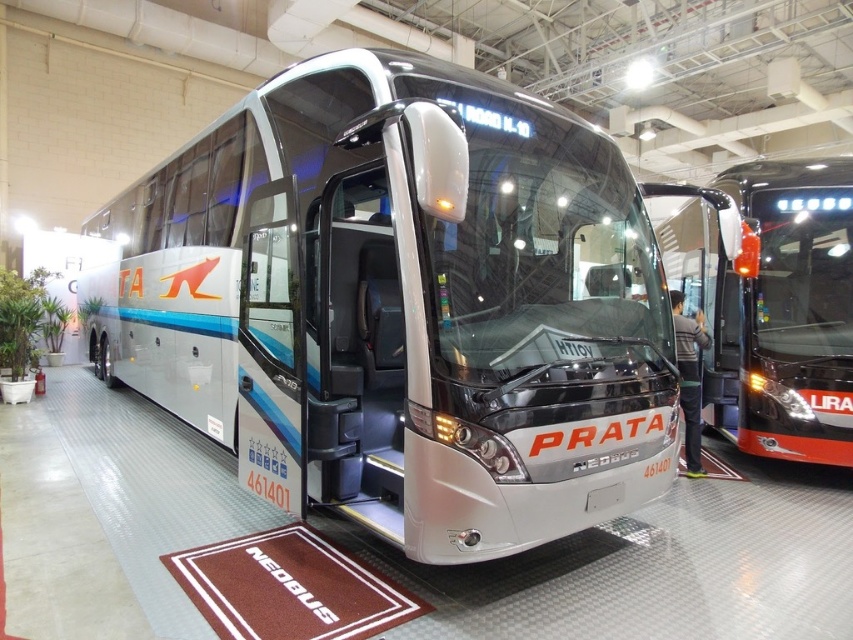
You are planning to place a new exhibit in the trade show. The exhibit requires a space that is 2 meters away from the sleek silver bus at center. Where should you place the exhibit to meet this requirement?

The exhibit should be placed at least 2 meters away from the sleek silver bus at center, which is located at point (402, 305). The exact placement would depend on the layout of the exhibition hall, but ensuring the distance requirement is met is crucial.

You are standing at point A located at coordinates point A at (422, 200). You need to walk to point B, which is 3.12 meters away from you. Is there enough space to walk directly to point B without any obstacles?

The distance between point A at (422, 200) and point B is 3.12 meters. Since the scene shows an indoor exhibition space with a high ceiling and exposed ductwork but no mention of obstacles between the points, there is likely enough space to walk directly to point B without any obstacles.